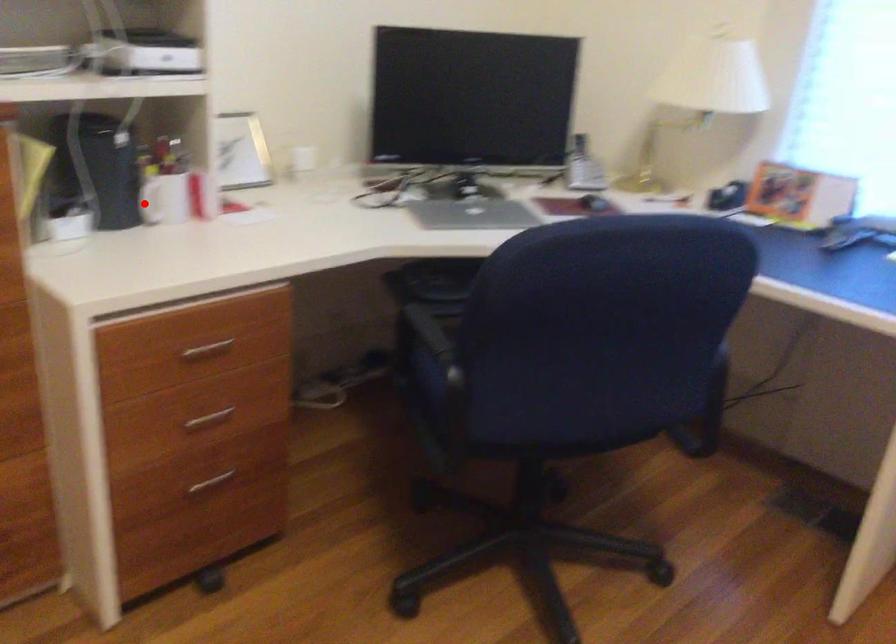
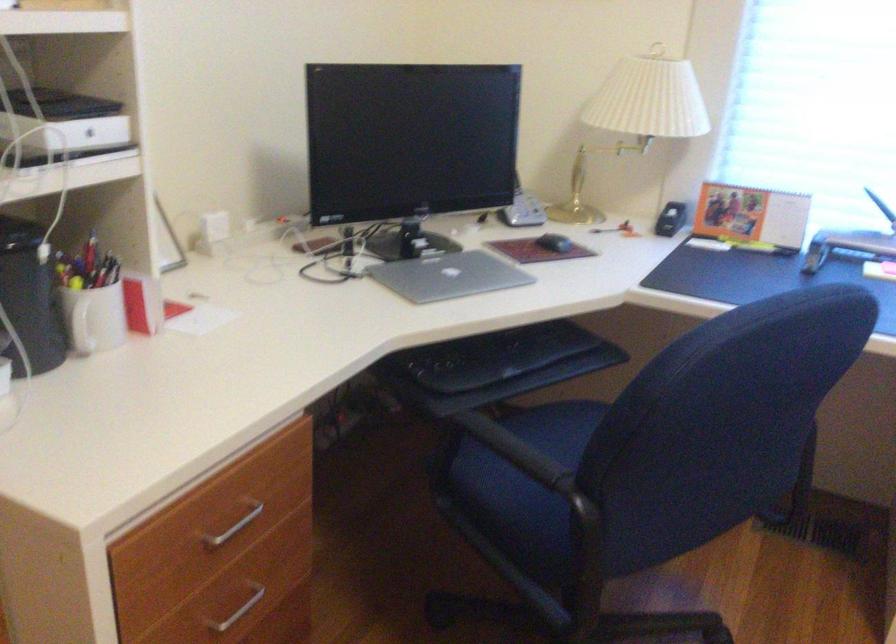
Find the pixel in the second image that matches the highlighted location in the first image.

(82, 328)